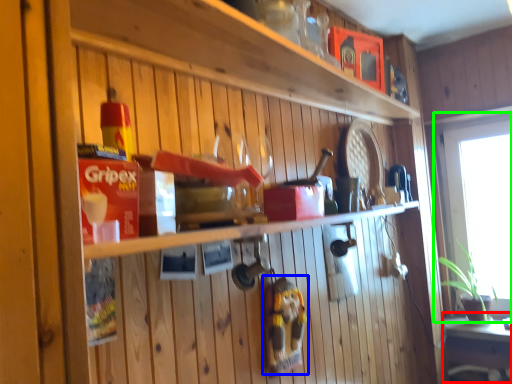
Question: Which object is the closest to the table (highlighted by a red box)? Choose among these: toy (highlighted by a blue box) or window (highlighted by a green box).

Choices:
 (A) toy
 (B) window

Answer: (B)